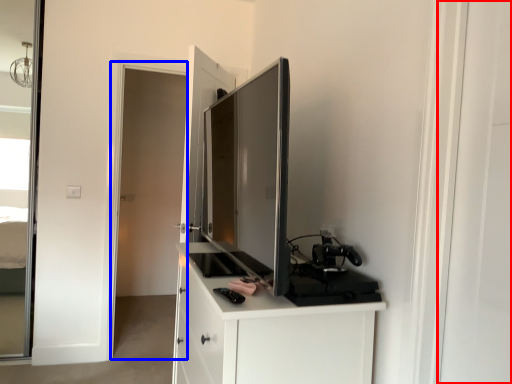
Question: Which object appears farthest to the camera in this image, screen door (highlighted by a red box) or screen door (highlighted by a blue box)?

Choices:
 (A) screen door
 (B) screen door

Answer: (B)